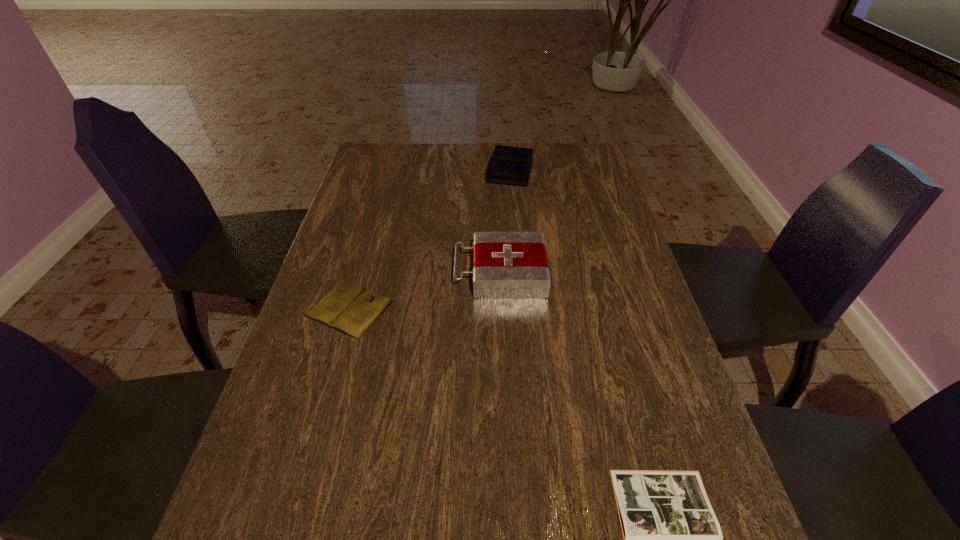
Where is `the tallest object`? Image resolution: width=960 pixels, height=540 pixels. the tallest object is located at coordinates (506, 265).

Where is `the farthest book`? This screenshot has height=540, width=960. the farthest book is located at coordinates (508, 165).

Identify the location of the tallest book. This screenshot has height=540, width=960. (508, 165).

Identify the location of the second farthest book. (349, 308).

Image resolution: width=960 pixels, height=540 pixels. Find the location of `the leftmost book`. the leftmost book is located at coordinates (349, 308).

Where is `free space located 0.350m on the front side of the first-aid kit`? free space located 0.350m on the front side of the first-aid kit is located at coordinates (324, 273).

Find the location of a particular element. This screenshot has width=960, height=540. free space located on the front side of the first-aid kit is located at coordinates (349, 273).

Image resolution: width=960 pixels, height=540 pixels. I want to click on blank space located 0.100m on the front side of the first-aid kit, so click(418, 273).

Where is `free space located 0.200m on the right of the farthest object`? free space located 0.200m on the right of the farthest object is located at coordinates (592, 171).

This screenshot has width=960, height=540. Find the location of `vacant area situated 0.360m on the back of the leftmost object`. vacant area situated 0.360m on the back of the leftmost object is located at coordinates (380, 202).